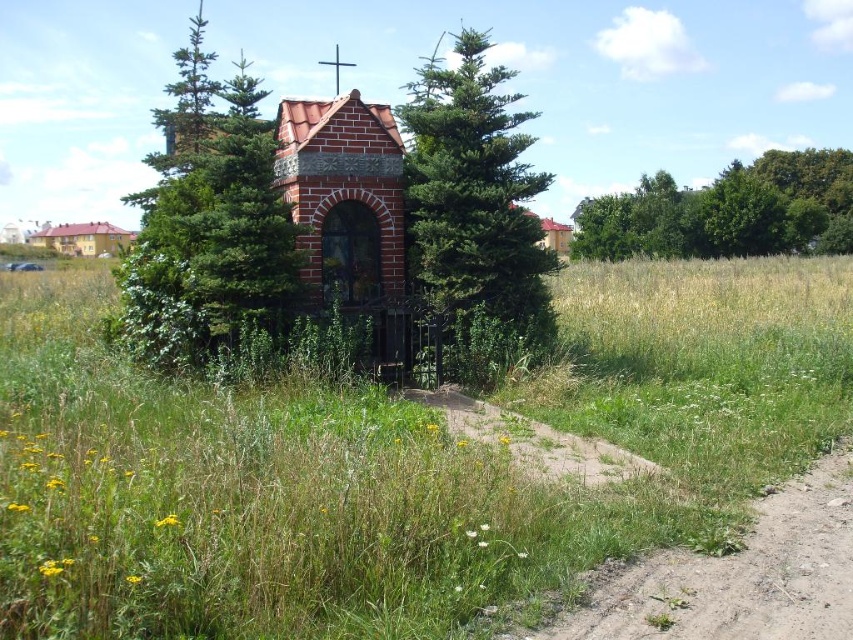
You are standing in a rural area and see the green leafy tree at center and the brown brick church at upper left. Which object is positioned to the right of the other?

The green leafy tree at center is positioned to the right of the brown brick church at upper left.

You are standing in a field with a green leafy tree at center and a brown brick church at upper left. Which object is larger in size?

The green leafy tree at center is bigger than the brown brick church at upper left.

You are standing in front of the chapel and want to take a photo of the green leafy trees at upper right. Where should you position yourself to ensure they are centered in the frame?

To center the green leafy trees at upper right in your photo, position yourself so that they are at the point marked by coordinates 0.331 on the horizontal axis and 0.853 on the vertical axis relative to the frame.